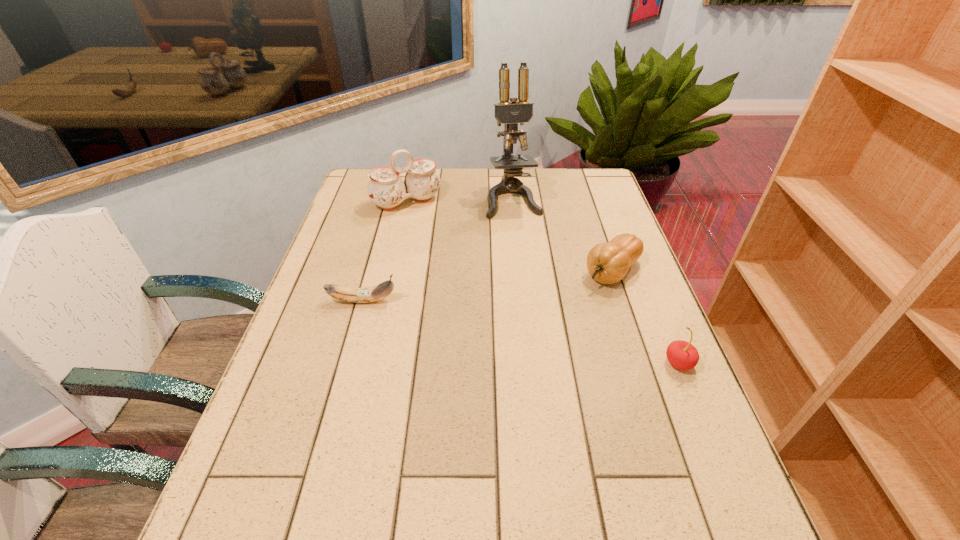
Locate an element on the screen. The height and width of the screenshot is (540, 960). vacant area situated 0.170m at the eyepieces of the tallest object is located at coordinates (528, 252).

Locate an element on the screen. vacant area situated by the handle of the fourth shortest object is located at coordinates (431, 233).

This screenshot has height=540, width=960. What are the coordinates of `free space located by the handle of the fourth shortest object` in the screenshot? It's located at (457, 271).

Identify the location of vacant area situated by the handle of the fourth shortest object. (428, 227).

What are the coordinates of `free space located on the stem side of the gourd` in the screenshot? It's located at (532, 346).

Locate an element on the screen. The image size is (960, 540). vacant space situated 0.380m on the stem side of the gourd is located at coordinates (503, 372).

Find the location of `vacant area situated 0.110m on the stem side of the gourd`. vacant area situated 0.110m on the stem side of the gourd is located at coordinates (573, 308).

You are a GUI agent. You are given a task and a screenshot of the screen. Output one action in this format:
    pyautogui.click(x=<x>, y=<y>)
    Task: Click on the microscope present at the far edge
    The width and height of the screenshot is (960, 540).
    Given the screenshot: What is the action you would take?
    pyautogui.click(x=510, y=113)

Where is `chinaware at the far edge`? This screenshot has height=540, width=960. chinaware at the far edge is located at coordinates (386, 189).

I want to click on banana at the left edge, so click(x=378, y=292).